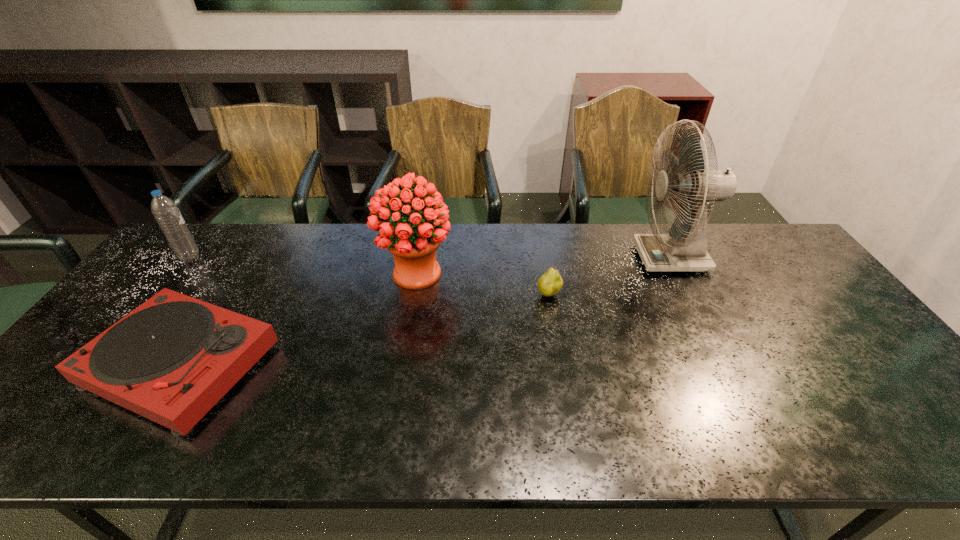
Identify the location of vacant area in the image that satisfies the following two spatial constraints: 1. on the back side of the record player; 2. on the right side of the third object from right to left. Image resolution: width=960 pixels, height=540 pixels. (239, 274).

Identify the location of vacant region that satisfies the following two spatial constraints: 1. on the front side of the water bottle; 2. on the left side of the third object from left to right. The width and height of the screenshot is (960, 540). (177, 274).